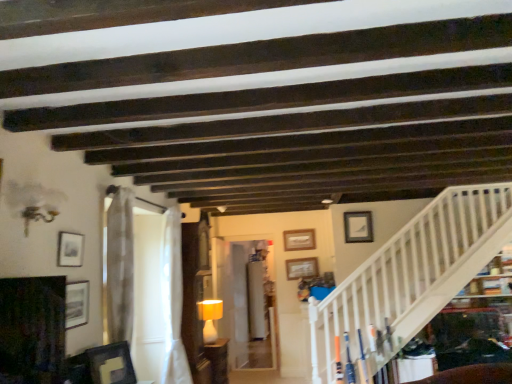
Question: Is matte white picture frame at upper right, marked as the sixth picture frame in a left-to-right arrangement, at the left side of sheer white curtain at center, the 2th curtain from the back?

Choices:
 (A) no
 (B) yes

Answer: (A)

Question: From a real-world perspective, is matte white picture frame at upper right, which is counted as the 4th picture frame, starting from the front, located beneath sheer white curtain at center, which is the first curtain in front-to-back order?

Choices:
 (A) no
 (B) yes

Answer: (A)

Question: Is matte white picture frame at upper right, marked as the sixth picture frame in a left-to-right arrangement, positioned in front of sheer white curtain at center, which is the first curtain in front-to-back order?

Choices:
 (A) no
 (B) yes

Answer: (A)

Question: Does matte white picture frame at upper right, marked as the sixth picture frame in a left-to-right arrangement, have a greater height compared to sheer white curtain at center, the 2th curtain from the back?

Choices:
 (A) no
 (B) yes

Answer: (A)

Question: Can you confirm if matte white picture frame at upper right, marked as the sixth picture frame in a left-to-right arrangement, is bigger than sheer white curtain at center, which is the first curtain in front-to-back order?

Choices:
 (A) yes
 (B) no

Answer: (B)

Question: Would you say matte yellow lampshade at center is inside or outside white wooden stairwell at lower right?

Choices:
 (A) inside
 (B) outside

Answer: (B)

Question: From the image's perspective, is matte yellow lampshade at center above or below white wooden stairwell at lower right?

Choices:
 (A) above
 (B) below

Answer: (B)

Question: In terms of width, does matte yellow lampshade at center look wider or thinner when compared to white wooden stairwell at lower right?

Choices:
 (A) thin
 (B) wide

Answer: (B)

Question: Relative to white wooden stairwell at lower right, is matte yellow lampshade at center in front or behind?

Choices:
 (A) front
 (B) behind

Answer: (B)

Question: In terms of height, does wooden picture frame at center, which is counted as the second picture frame, starting from the right, look taller or shorter compared to matte white picture frame at upper right, the third picture frame viewed from the back?

Choices:
 (A) tall
 (B) short

Answer: (B)

Question: Considering the positions of wooden picture frame at center, which ranks as the 5th picture frame in front-to-back order, and matte white picture frame at upper right, which is counted as the 4th picture frame, starting from the front, in the image, is wooden picture frame at center, which ranks as the 5th picture frame in front-to-back order, bigger or smaller than matte white picture frame at upper right, which is counted as the 4th picture frame, starting from the front,?

Choices:
 (A) big
 (B) small

Answer: (A)

Question: Would you say wooden picture frame at center, which is counted as the second picture frame, starting from the right, is inside or outside matte white picture frame at upper right, the third picture frame viewed from the back?

Choices:
 (A) outside
 (B) inside

Answer: (A)

Question: Is point (295, 269) closer or farther from the camera than point (348, 221)?

Choices:
 (A) closer
 (B) farther

Answer: (B)

Question: From a real-world perspective, relative to matte black picture frame at lower left, which is the third picture frame from left to right, is matte black picture frame at left, the 6th picture frame when ordered from back to front, vertically above or below?

Choices:
 (A) below
 (B) above

Answer: (B)

Question: Is matte black picture frame at left, the fifth picture frame positioned from the right, in front of or behind matte black picture frame at lower left, which is the third picture frame from left to right, in the image?

Choices:
 (A) front
 (B) behind

Answer: (A)